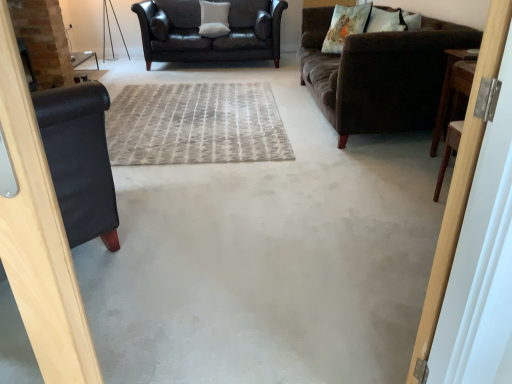
This screenshot has width=512, height=384. What are the coordinates of `empty space that is in between brown velvety couch at upper right, placed as the first studio couch when sorted from front to back, and brown wooden table at right` in the screenshot? It's located at (392, 160).